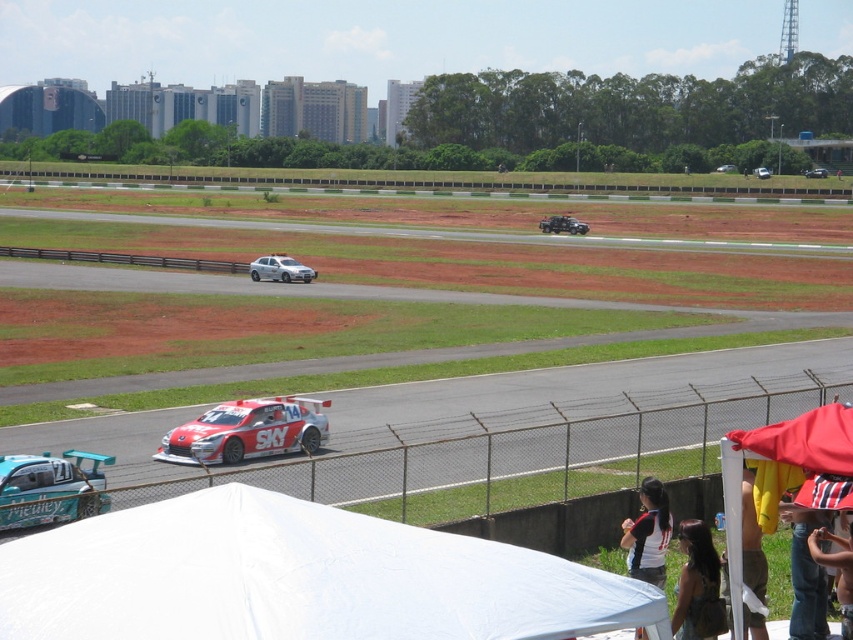
You are a race car driver preparing for a pit stop. You see a white glossy race car at center and a matte black car at center. Which car is positioned lower on the track?

The white glossy race car at center is located below the matte black car at center, so it is positioned lower on the track.

You are standing at the point where the race car is currently positioned. Looking towards the white fabric canopy at lower center located at point (x=297, y=579), is the canopy to your left or right?

The white fabric canopy at lower center is located at point (x=297, y=579), so from the race car position, it would be to the right side.